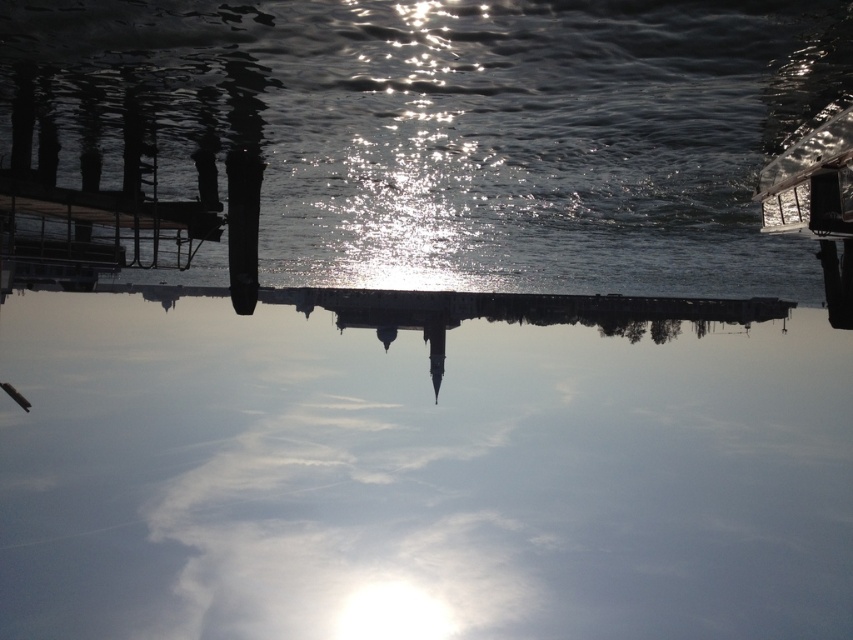
You are standing at point A with coordinates point A at (422, 577) and want to reach point B at 0.497, 0.902. The distance between them is 336.23 meters. If you can walk 100 meters per minute, how many minutes will it take you to walk from point A to point B?

The distance between point A and point B is 336.23 meters. At a walking speed of 100 meters per minute, it will take approximately 3.36 minutes to walk from point A to point B.

You are an artist trying to paint the scene. You notice two types of water surfaces in the image. Which one is bigger in size between the transparent glass water at center and the glistening water at center?

The transparent glass water at center is larger in size than the glistening water at center.

Looking at this image, you are standing on the dark wood dock at left and want to reach the glistening water at center. Is the water directly in front of you, or do you need to move sideways?

The glistening water at center is positioned over dark wood dock at left, so the water is directly in front of you.